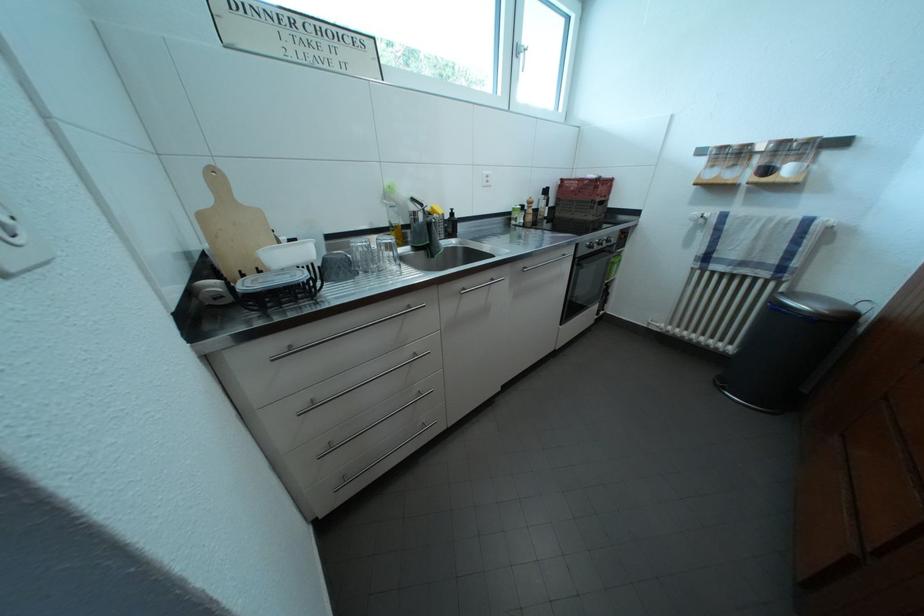
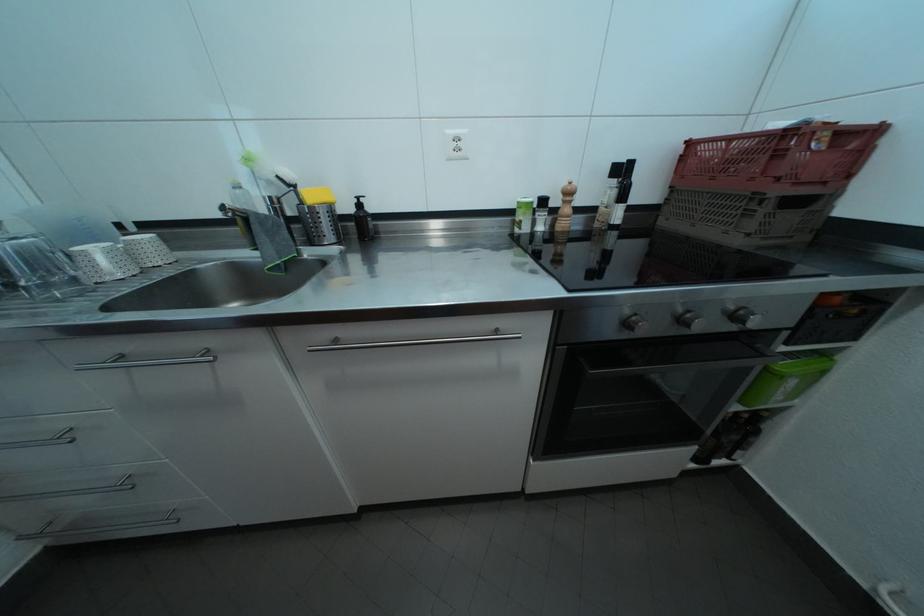
Locate, in the second image, the point that corresponds to the point at 609,249 in the first image.

(691, 326)